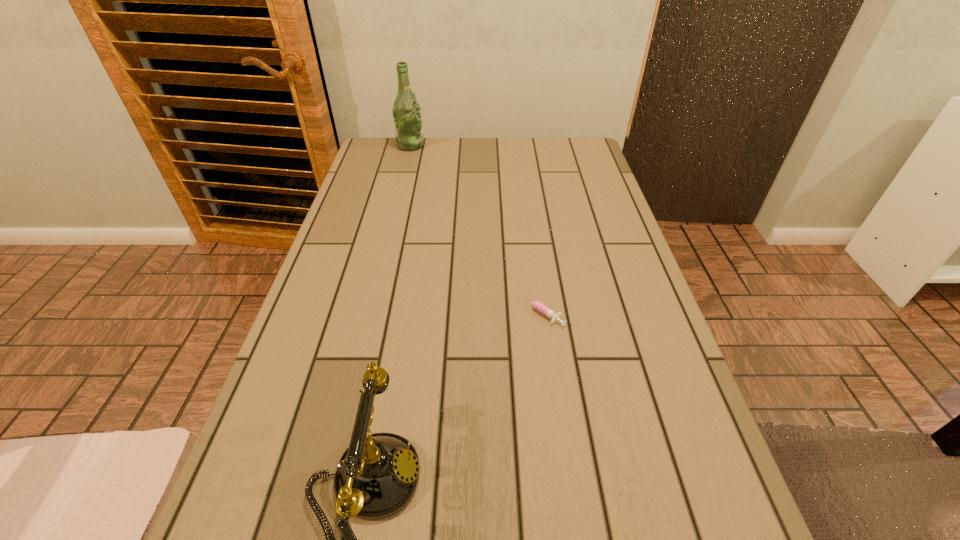
The image size is (960, 540). In order to click on blank area in the image that satisfies the following two spatial constraints: 1. on the surface of the farthest object; 2. on the back side of the syringe in this screenshot , I will do `click(370, 312)`.

What are the coordinates of `free space that satisfies the following two spatial constraints: 1. on the surface of the beer bottle; 2. on the back side of the syringe` in the screenshot? It's located at (370, 312).

Image resolution: width=960 pixels, height=540 pixels. I want to click on free space in the image that satisfies the following two spatial constraints: 1. on the surface of the shortest object; 2. on the right side of the farthest object, so pos(370,312).

Identify the location of free space in the image that satisfies the following two spatial constraints: 1. on the surface of the beer bottle; 2. on the right side of the rightmost object. The width and height of the screenshot is (960, 540). (370, 312).

This screenshot has height=540, width=960. Find the location of `vacant space that satisfies the following two spatial constraints: 1. on the surface of the beer bottle; 2. on the back side of the second farthest object`. vacant space that satisfies the following two spatial constraints: 1. on the surface of the beer bottle; 2. on the back side of the second farthest object is located at coordinates tap(370, 312).